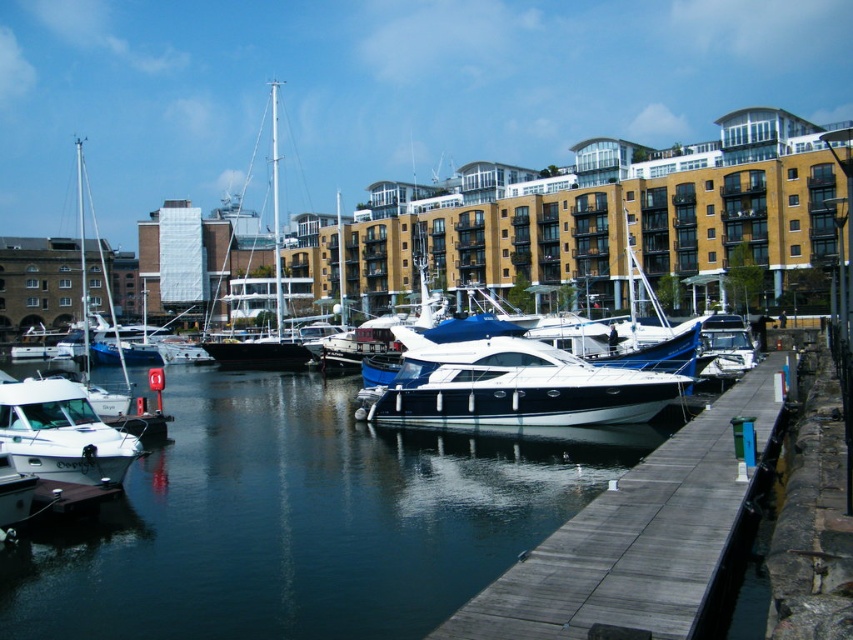
Is wooden at center behind white glossy motorboat at center?

No, it is in front of white glossy motorboat at center.

Who is lower down, wooden at center or white glossy motorboat at center?

wooden at center is below.

Between point (584, 563) and point (453, 416), which one is positioned behind?

Point (453, 416)

I want to click on wooden at center, so click(x=635, y=538).

Is glossy water at center taller than shiny white sailboat at center?

Incorrect, glossy water at center's height is not larger of shiny white sailboat at center's.

Does glossy water at center appear on the left side of shiny white sailboat at center?

Incorrect, glossy water at center is not on the left side of shiny white sailboat at center.

Is point (282, 438) less distant than point (271, 140)?

Yes.

Image resolution: width=853 pixels, height=640 pixels. Identify the location of glossy water at center. (302, 520).

Is white glossy boat at lower left shorter than shiny white sailboat at center?

Yes.

Which is in front, point (9, 388) or point (273, 202)?

Point (9, 388)

The width and height of the screenshot is (853, 640). Describe the element at coordinates (61, 433) in the screenshot. I see `white glossy boat at lower left` at that location.

Find the location of a particular element. white glossy boat at lower left is located at coordinates (61, 433).